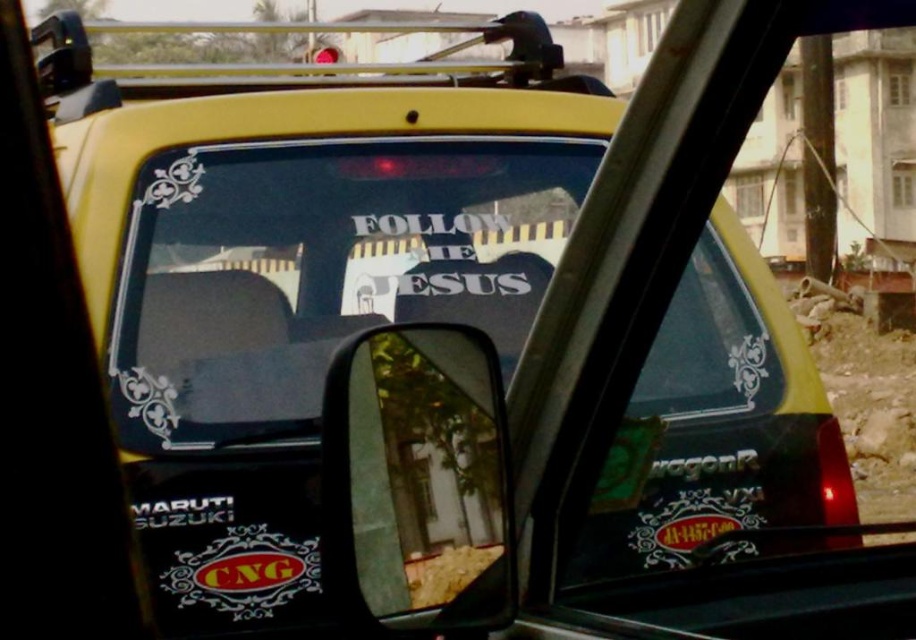
Question: Can you confirm if transparent vinyl sticker at center is positioned to the left of clear plastic mirror at center?

Choices:
 (A) yes
 (B) no

Answer: (A)

Question: From the image, what is the correct spatial relationship of transparent vinyl sticker at center in relation to clear plastic mirror at center?

Choices:
 (A) above
 (B) below

Answer: (A)

Question: Observing the image, what is the correct spatial positioning of transparent vinyl sticker at center in reference to clear plastic mirror at center?

Choices:
 (A) above
 (B) below

Answer: (A)

Question: Which point is farther from the camera taking this photo?

Choices:
 (A) (166, 196)
 (B) (446, 323)

Answer: (A)